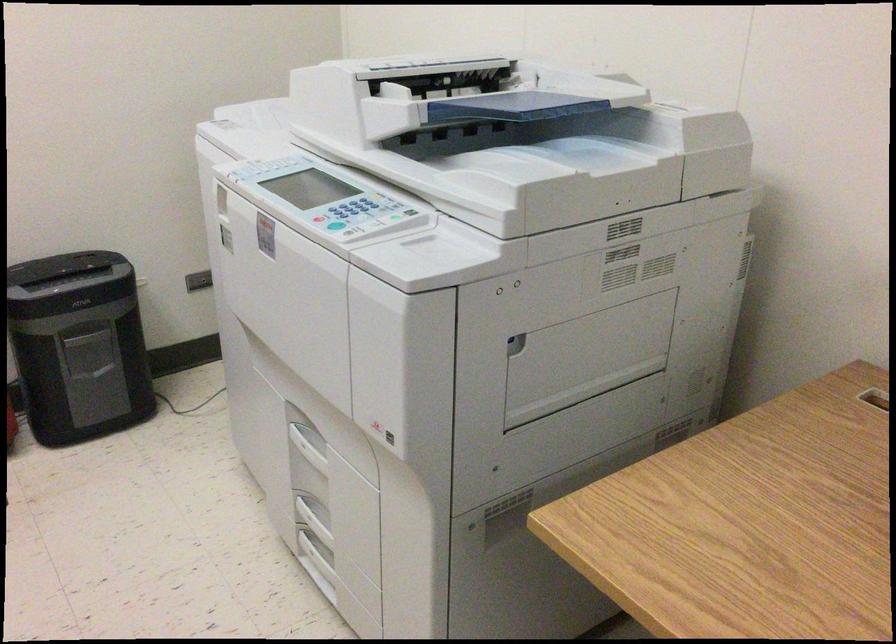
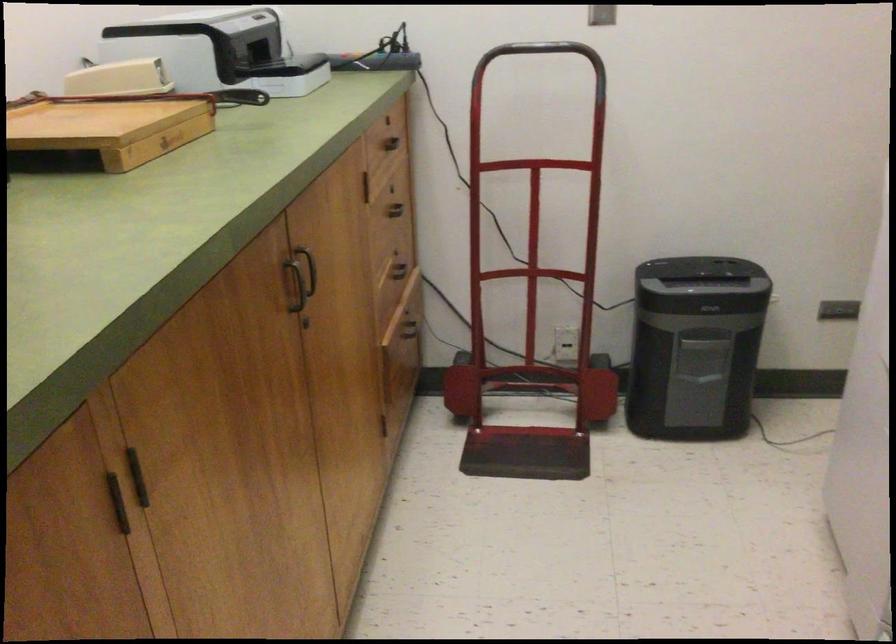
Question: The camera is either moving clockwise (left) or counter-clockwise (right) around the object. The first image is from the beginning of the video and the second image is from the end. Is the camera moving left or right when shooting the video?

Choices:
 (A) Left
 (B) Right

Answer: (B)